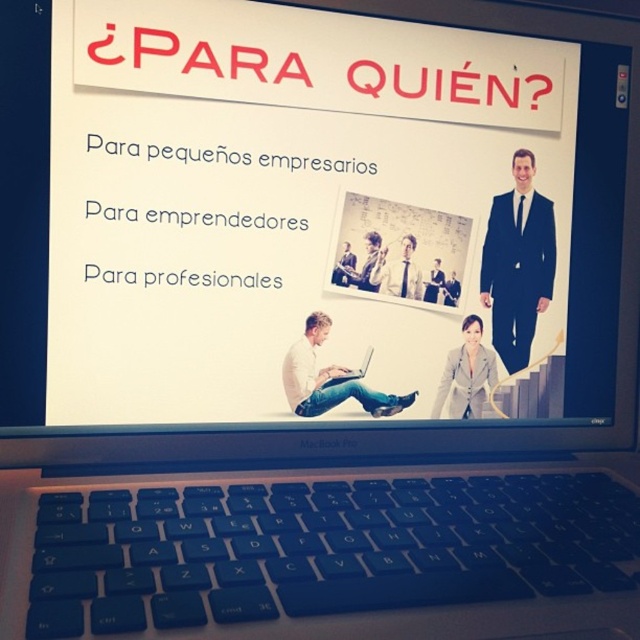
You are setting up a laptop for a presentation. You have a blue plastic keyboard at lower center and a white matte laptop at center. Where should you place the keyboard relative to the laptop to align with standard setup practices?

The blue plastic keyboard at lower center should be placed below the white matte laptop at center as it is the standard position for a keyboard in relation to a laptop during presentations.

You are a user trying to reach the blue plastic keyboard at lower center while sitting at a desk. The keyboard is located at point (333, 557). If your hand is currently at point 0.7, 0.6, which direction should you move your hand to reach the keyboard?

To reach the blue plastic keyboard at lower center located at point (333, 557) from your current position at 0.7, 0.6, you should move your hand to the right and down since the keyboard is at a higher x coordinate and lower y coordinate compared to your hand.

You are setting up a presentation and need to place the blue plastic keyboard at lower center and the silver metallic laptop at center on a table. If the laptop must be positioned higher than the keyboard to avoid glare from the projector, can you adjust their positions based on their current sizes?

The blue plastic keyboard at lower center is much taller than the silver metallic laptop at center. Since the laptop is shorter, you can place it higher than the keyboard to meet the requirement.